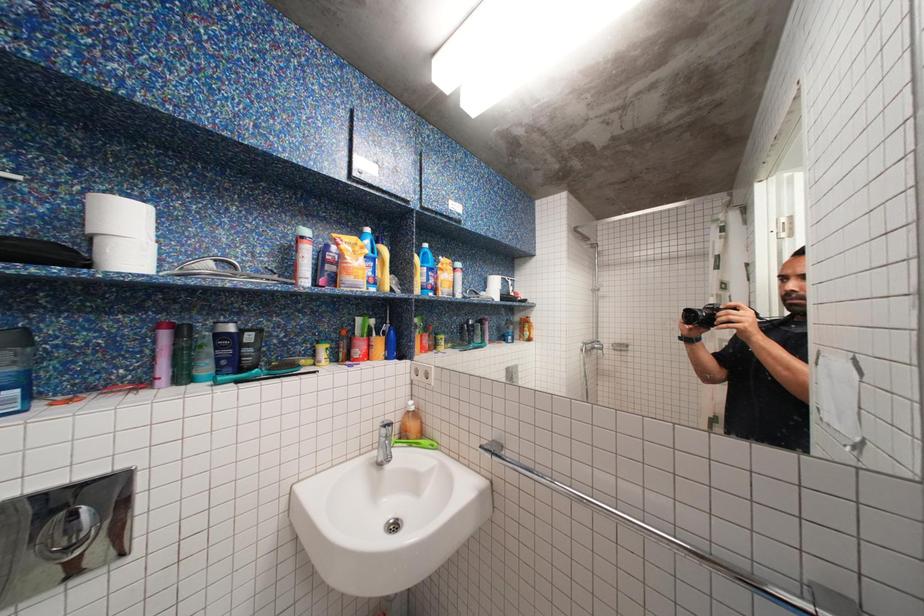
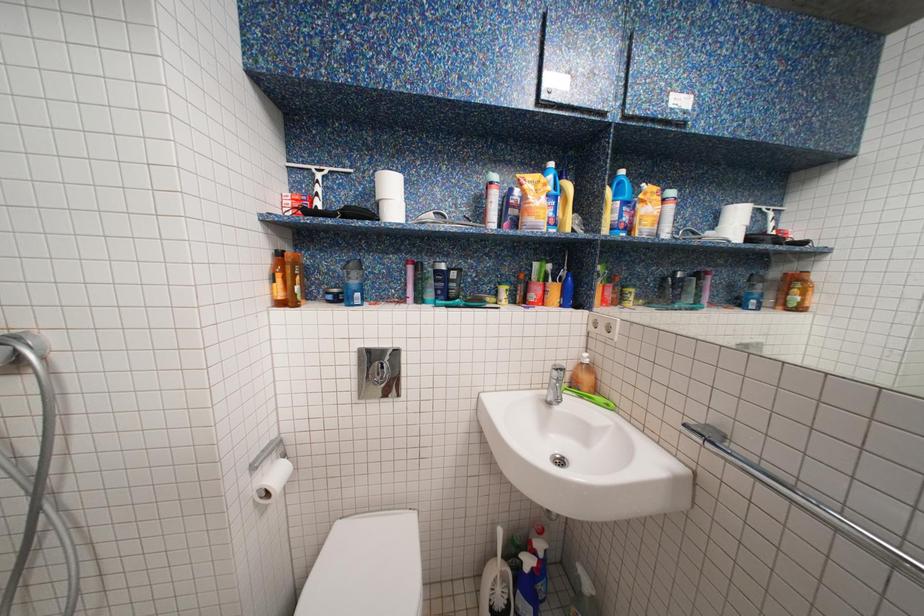
Question: The camera is either moving clockwise (left) or counter-clockwise (right) around the object. The first image is from the beginning of the video and the second image is from the end. Is the camera moving left or right when shooting the video?

Choices:
 (A) Left
 (B) Right

Answer: (B)